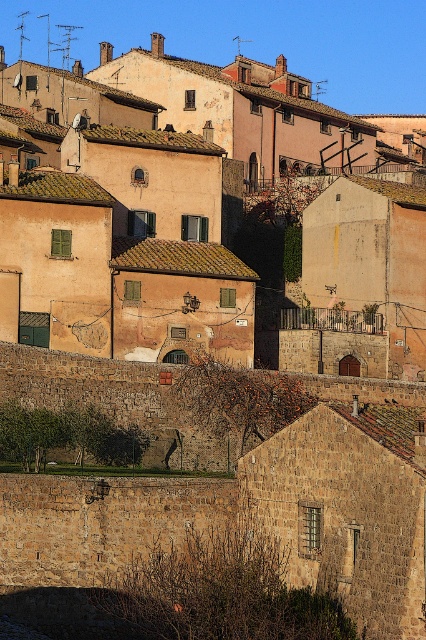
You are a photographer planning to take a wide shot of the rustic stone houses at center and the brown stone wall at lower left. Based on their widths, which object would require more space in the frame to capture fully?

The rustic stone houses at center might be wider than brown stone wall at lower left, so they would require more space in the frame to capture fully.

You are standing at the point marked by the coordinates point (222, 220) in the image. Looking around, you see rustic stone houses at center. What is the most prominent feature of the buildings in this village?

The most prominent feature of the rustic stone houses at center is their traditional stone construction with terracotta roofs, some adorned with chimneys and satellite dishes, and warm earthy tones such as beige and light brown.

You are standing in front of the village scene. You see the rustic stone houses at center and the brown stone wall at lower left. Which object is positioned higher in the image?

The rustic stone houses at center are positioned higher than the brown stone wall at lower left.